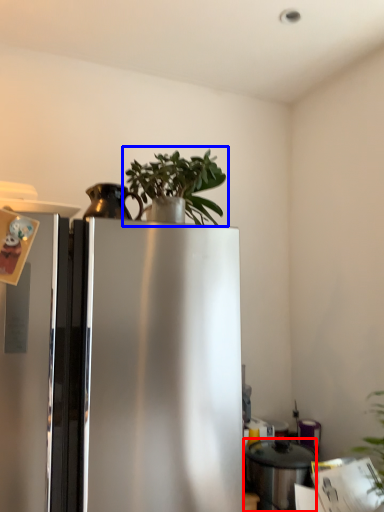
Question: Among these objects, which one is farthest to the camera, appliance (highlighted by a red box) or houseplant (highlighted by a blue box)?

Choices:
 (A) appliance
 (B) houseplant

Answer: (A)